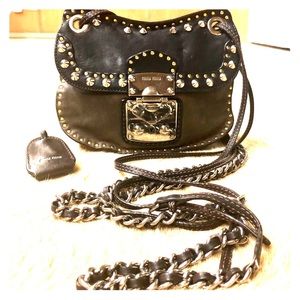
The height and width of the screenshot is (300, 300). Identify the location of floor to right of purse. (260, 105).